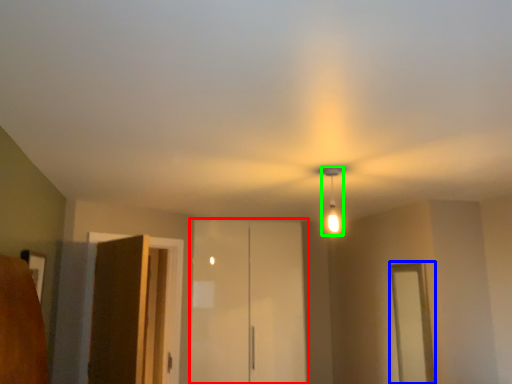
Question: Which object is positioned farthest from elevator (highlighted by a red box)? Select from window (highlighted by a blue box) and light fixture (highlighted by a green box).

Choices:
 (A) window
 (B) light fixture

Answer: (B)